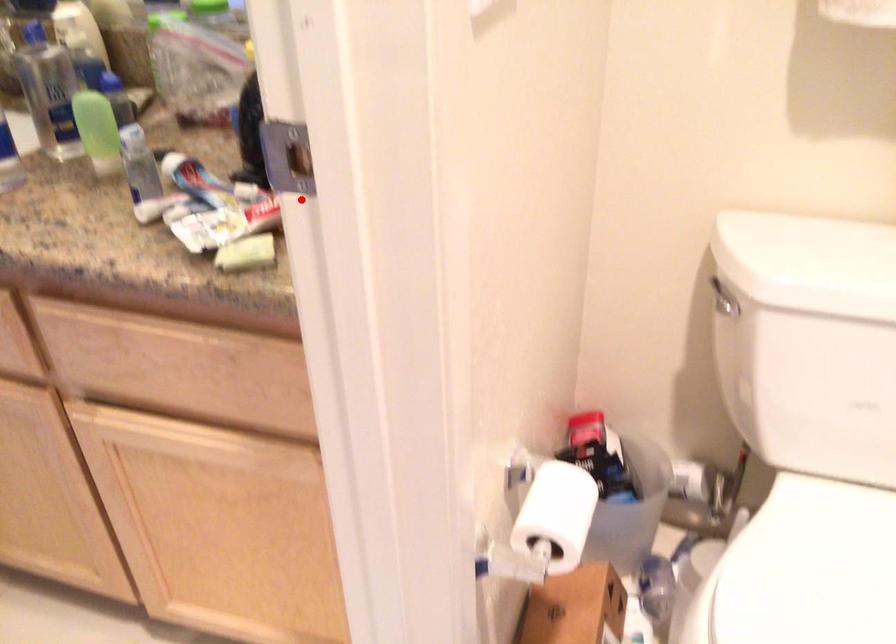
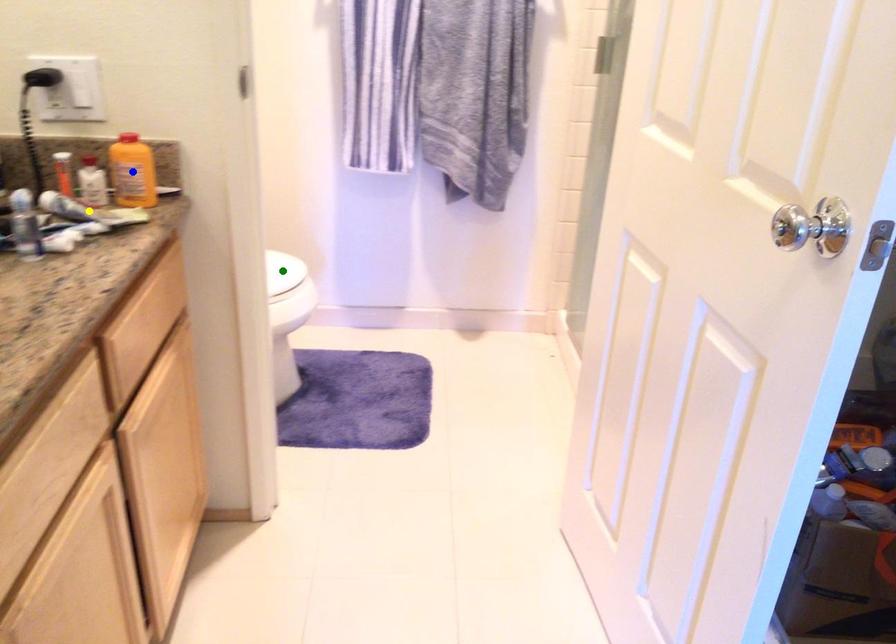
Question: I am providing you with two images of the same scene from different viewpoints. A red point is marked on the first image. You are given multiple points on the second image. Which spot in image 2 lines up with the point in image 1?

Choices:
 (A) green point
 (B) yellow point
 (C) blue point

Answer: (C)